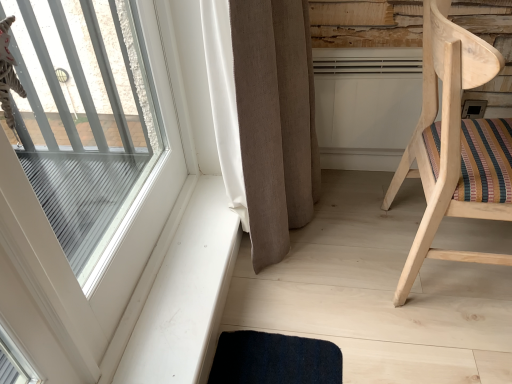
The image size is (512, 384). Identify the location of blank area beneath clear glass window at upper left (from a real-world perspective). (151, 275).